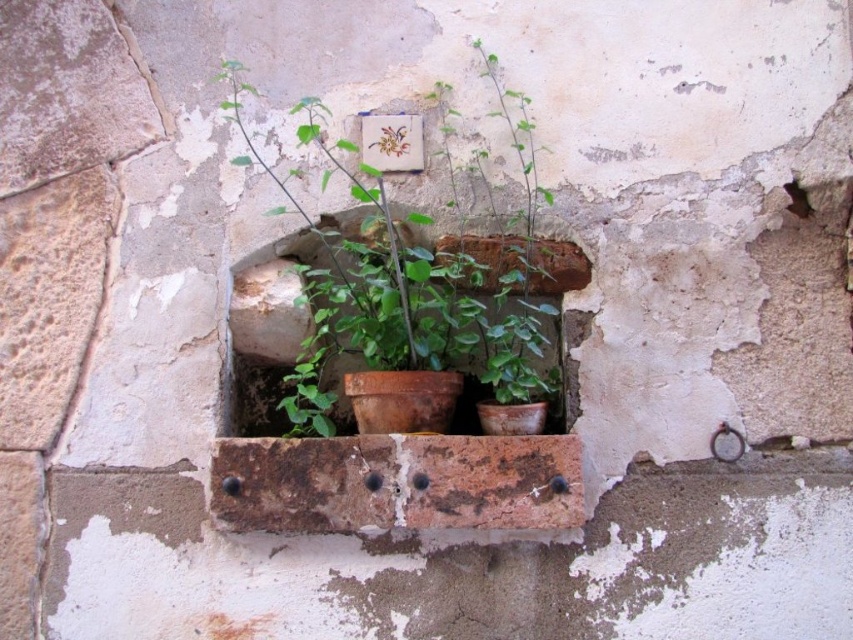
Question: Is brown terracotta pot at center further to camera compared to terracotta pot at center?

Choices:
 (A) no
 (B) yes

Answer: (A)

Question: Which point appears closest to the camera in this image?

Choices:
 (A) (384, 120)
 (B) (506, 332)

Answer: (B)

Question: Can you confirm if brown terracotta pot at center is smaller than terracotta pot at center?

Choices:
 (A) no
 (B) yes

Answer: (A)

Question: Can you confirm if brown terracotta pot at center is bigger than terracotta pot at center?

Choices:
 (A) no
 (B) yes

Answer: (B)